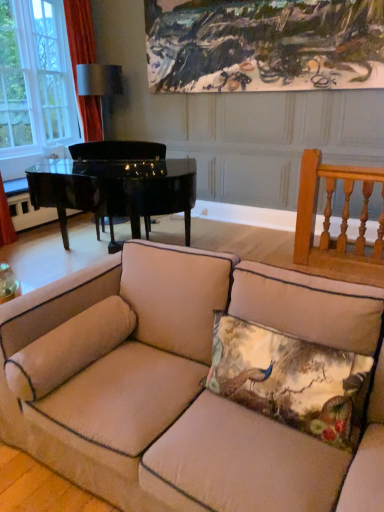
Question: Does clear glass window at upper left come in front of orange fabric curtain at upper left?

Choices:
 (A) yes
 (B) no

Answer: (B)

Question: Is clear glass window at upper left wider than orange fabric curtain at upper left?

Choices:
 (A) yes
 (B) no

Answer: (B)

Question: Would you say orange fabric curtain at upper left is part of clear glass window at upper left's contents?

Choices:
 (A) no
 (B) yes

Answer: (A)

Question: Is clear glass window at upper left thinner than orange fabric curtain at upper left?

Choices:
 (A) no
 (B) yes

Answer: (B)

Question: Does clear glass window at upper left appear on the right side of orange fabric curtain at upper left?

Choices:
 (A) no
 (B) yes

Answer: (A)

Question: Is silky floral pillow at center, placed as the first pillow when sorted from right to left, taller or shorter than orange fabric curtain at upper left?

Choices:
 (A) tall
 (B) short

Answer: (B)

Question: Relative to orange fabric curtain at upper left, is silky floral pillow at center, positioned as the second pillow in left-to-right order, in front or behind?

Choices:
 (A) front
 (B) behind

Answer: (A)

Question: Considering the positions of point [x=352, y=425] and point [x=82, y=62], is point [x=352, y=425] closer or farther from the camera than point [x=82, y=62]?

Choices:
 (A) closer
 (B) farther

Answer: (A)

Question: From a real-world perspective, relative to orange fabric curtain at upper left, is silky floral pillow at center, placed as the first pillow when sorted from right to left, vertically above or below?

Choices:
 (A) below
 (B) above

Answer: (A)

Question: Considering their positions, is silky floral pillow at center, placed as the first pillow when sorted from right to left, located in front of or behind beige fabric couch at center?

Choices:
 (A) behind
 (B) front

Answer: (A)

Question: From a real-world perspective, is silky floral pillow at center, placed as the first pillow when sorted from right to left, physically located above or below beige fabric couch at center?

Choices:
 (A) below
 (B) above

Answer: (B)

Question: Is point (355, 386) positioned closer to the camera than point (0, 411)?

Choices:
 (A) closer
 (B) farther

Answer: (A)

Question: Is silky floral pillow at center, positioned as the second pillow in left-to-right order, situated inside beige fabric couch at center or outside?

Choices:
 (A) inside
 (B) outside

Answer: (A)

Question: In terms of size, does beige fabric couch at center appear bigger or smaller than black polished piano at left?

Choices:
 (A) big
 (B) small

Answer: (B)

Question: From their relative heights in the image, would you say beige fabric couch at center is taller or shorter than black polished piano at left?

Choices:
 (A) short
 (B) tall

Answer: (A)